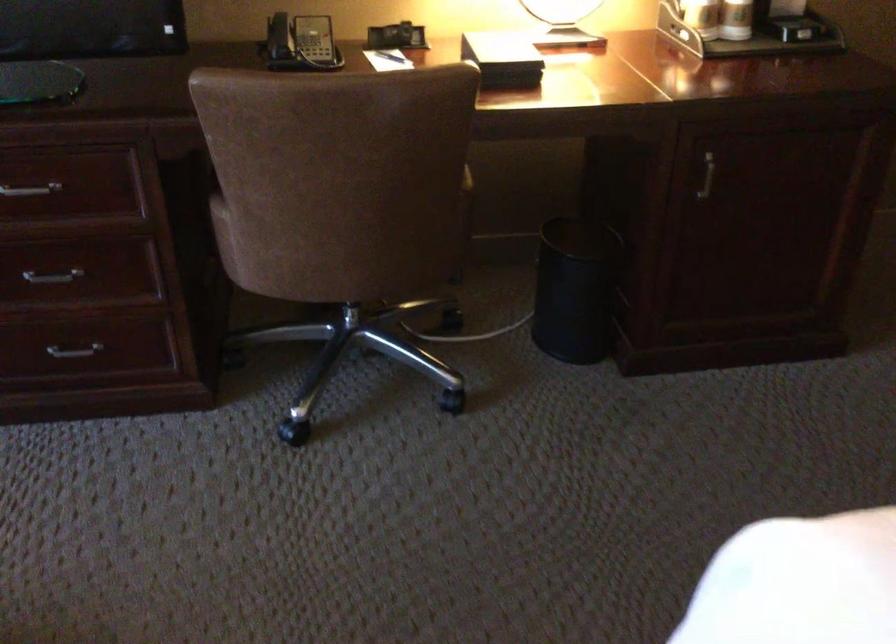
The width and height of the screenshot is (896, 644). What are the coordinates of `telephone handset` in the screenshot? It's located at (307, 32).